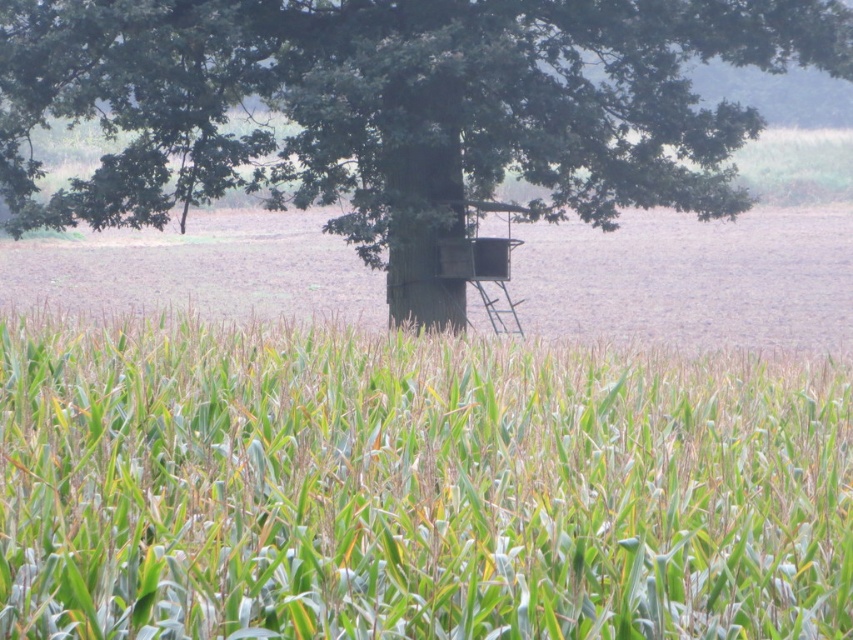
Measure the distance between point (x=80, y=470) and camera.

Point (x=80, y=470) is 4.13 meters away from camera.

Does green matte corn field at center appear on the left side of green wood tree at center?

In fact, green matte corn field at center is to the right of green wood tree at center.

Is point (691, 563) farther from camera compared to point (558, 205)?

No, (691, 563) is closer to viewer.

Where is `green matte corn field at center`? The image size is (853, 640). green matte corn field at center is located at coordinates (413, 486).